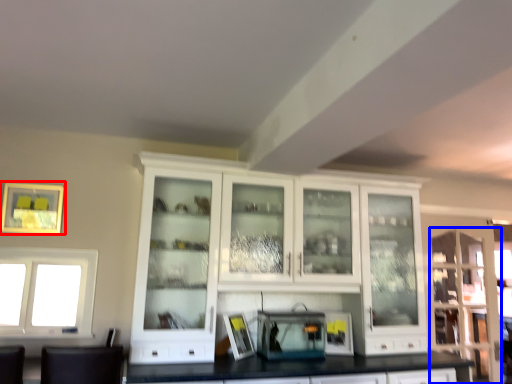
Question: Which object is closer to the camera taking this photo, picture frame (highlighted by a red box) or glass door (highlighted by a blue box)?

Choices:
 (A) picture frame
 (B) glass door

Answer: (A)